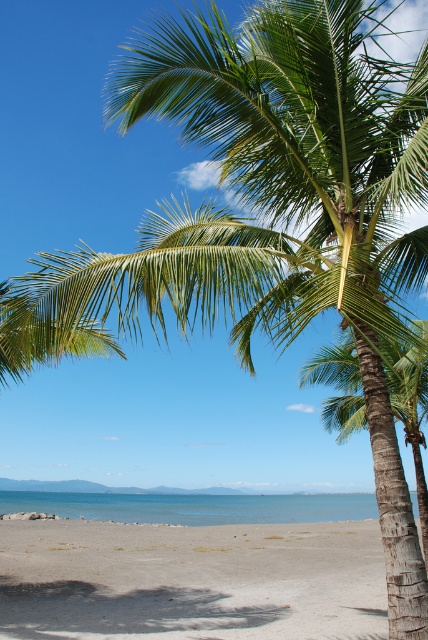
Is light brown sandy beach at lower center thinner than blue water at lower center?

Yes, light brown sandy beach at lower center is thinner than blue water at lower center.

Does light brown sandy beach at lower center lie behind blue water at lower center?

No, it is not.

At what (x,y) coordinates should I click in order to perform the action: click on light brown sandy beach at lower center. Please return your answer as a coordinate pair (x, y). The height and width of the screenshot is (640, 428). Looking at the image, I should click on (192, 580).